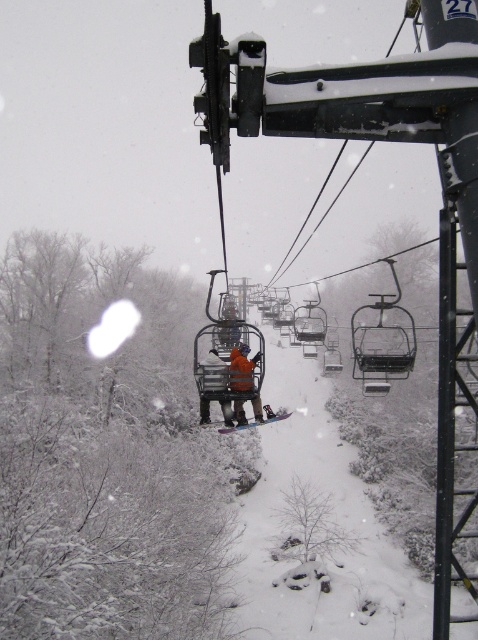
Who is positioned more to the left, orange fleece jacket at center or orange fabric jacket at center?

Positioned to the left is orange fabric jacket at center.

Locate an element on the screen. orange fleece jacket at center is located at coordinates (241, 368).

Measure the distance between orange fleece jacket at center and camera.

orange fleece jacket at center and camera are 47.56 feet apart from each other.

Identify the location of orange fleece jacket at center. The height and width of the screenshot is (640, 478). (241, 368).